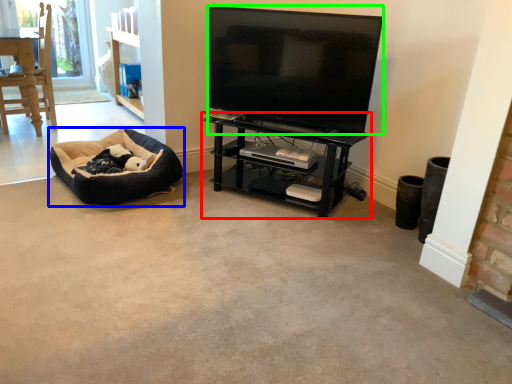
Question: Which object is the farthest from shelf (highlighted by a red box)? Choose among these: dog bed (highlighted by a blue box) or television (highlighted by a green box).

Choices:
 (A) dog bed
 (B) television

Answer: (A)